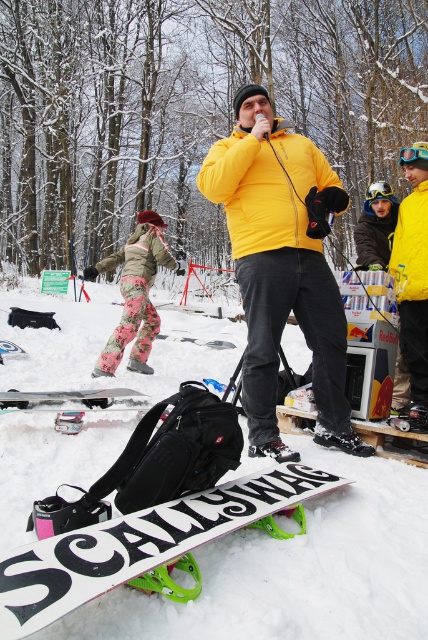
Question: Can you confirm if yellow matte jacket at center is positioned below white matte snowboard at lower left?

Choices:
 (A) yes
 (B) no

Answer: (B)

Question: Does white matte snowboard at lower center come in front of floral-patterned pants at left?

Choices:
 (A) yes
 (B) no

Answer: (A)

Question: Does white matte snowboard at center have a greater width compared to white matte snowboard at lower center?

Choices:
 (A) yes
 (B) no

Answer: (A)

Question: Estimate the real-world distances between objects in this image. Which object is closer to the floral-patterned pants at left?

Choices:
 (A) white matte snowboard at lower center
 (B) white matte snowboard at lower left
 (C) yellow matte jacket at center
 (D) white matte snowboard at center

Answer: (B)

Question: Which of the following is the closest to the observer?

Choices:
 (A) (23, 451)
 (B) (62, 580)
 (C) (125, 244)
 (D) (270, 406)

Answer: (B)

Question: Considering the real-world distances, which object is closest to the yellow matte jacket at center?

Choices:
 (A) white matte snowboard at lower center
 (B) floral-patterned pants at left
 (C) white matte snowboard at center

Answer: (A)